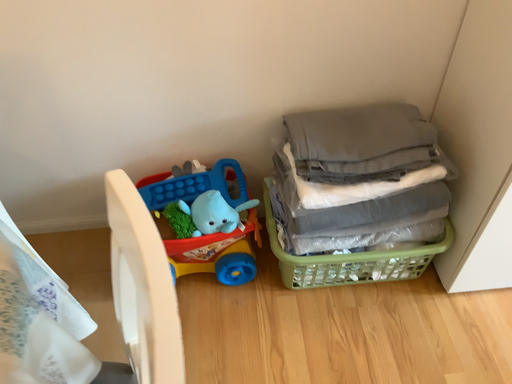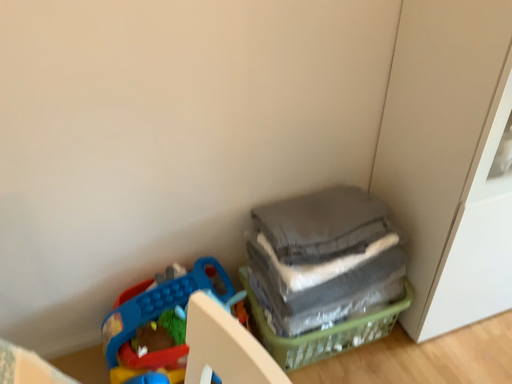
Question: Which way did the camera rotate in the video?

Choices:
 (A) rotated downward
 (B) rotated upward

Answer: (B)